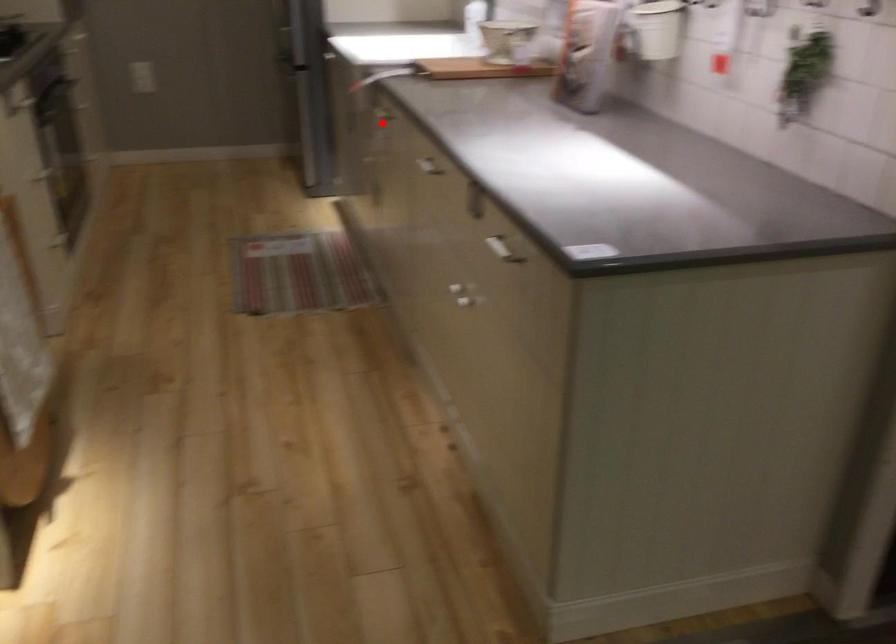
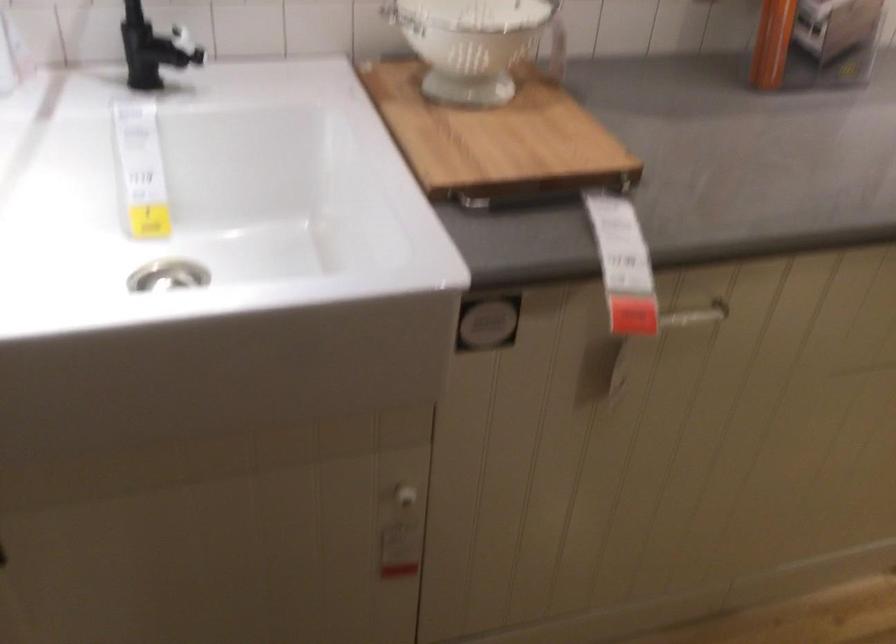
Locate, in the second image, the point that corresponds to the highlighted location in the first image.

(695, 315)